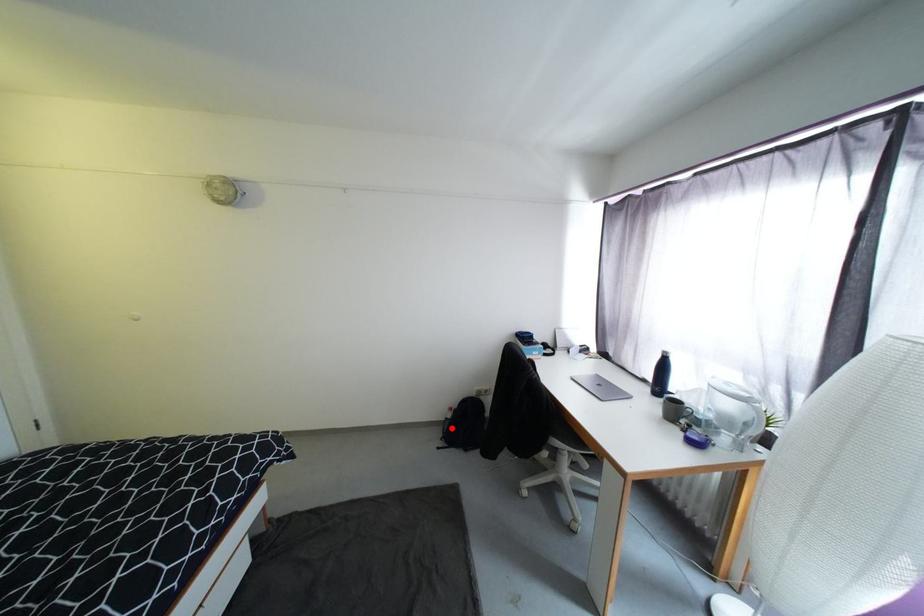
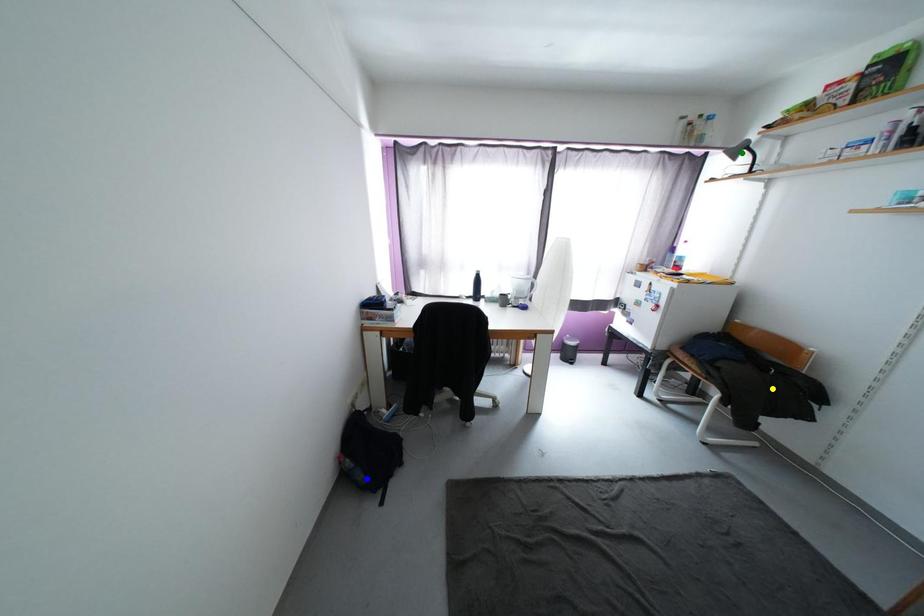
Question: I am providing you with two images of the same scene from different viewpoints. A red point is marked on the first image. You are given multiple points on the second image. Which point in image 2 represents the same 3d spot as the red point in image 1?

Choices:
 (A) green point
 (B) blue point
 (C) yellow point

Answer: (B)